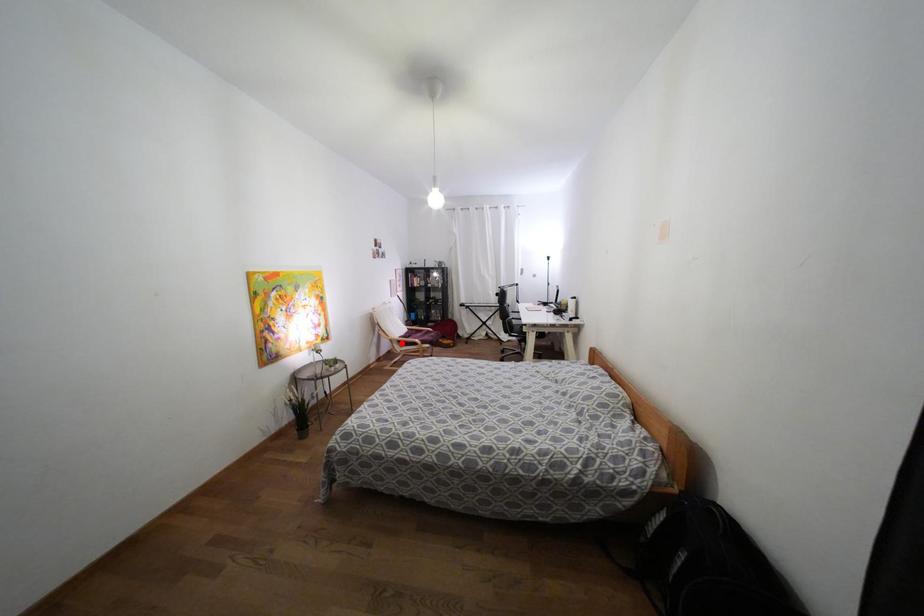
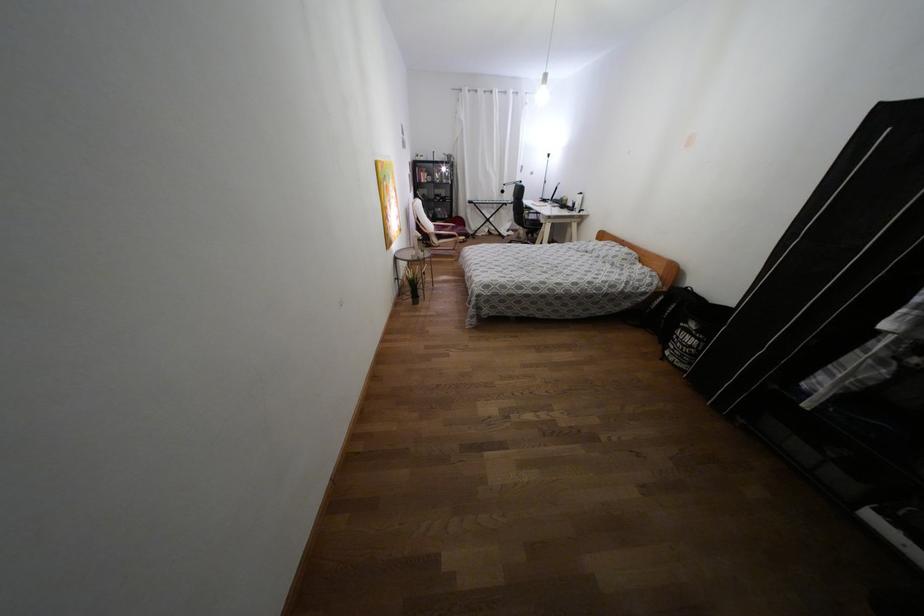
Question: I am providing you with two images of the same scene from different viewpoints. In image1, a red point is highlighted. Considering the same 3D point in image2, which of the following is correct?

Choices:
 (A) It is closer
 (B) It is farther

Answer: (A)